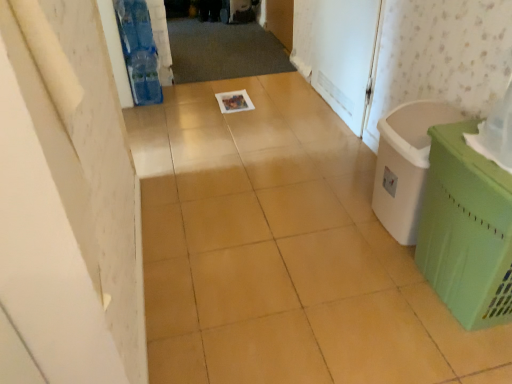
Question: From a real-world perspective, is green plastic laundry basket at right positioned over white matte screen door at upper right based on gravity?

Choices:
 (A) yes
 (B) no

Answer: (B)

Question: Does green plastic laundry basket at right have a larger size compared to white matte screen door at upper right?

Choices:
 (A) yes
 (B) no

Answer: (A)

Question: Is green plastic laundry basket at right wider than white matte screen door at upper right?

Choices:
 (A) no
 (B) yes

Answer: (B)

Question: Could white matte screen door at upper right be considered to be inside green plastic laundry basket at right?

Choices:
 (A) no
 (B) yes

Answer: (A)

Question: Considering the relative sizes of green plastic laundry basket at right and white matte screen door at upper right in the image provided, is green plastic laundry basket at right taller than white matte screen door at upper right?

Choices:
 (A) no
 (B) yes

Answer: (A)

Question: Is green plastic laundry basket at right not close to white matte screen door at upper right?

Choices:
 (A) no
 (B) yes

Answer: (A)

Question: Is white matte screen door at upper right located outside green plastic laundry basket at right?

Choices:
 (A) no
 (B) yes

Answer: (B)

Question: Is green plastic laundry basket at right surrounded by white matte screen door at upper right?

Choices:
 (A) no
 (B) yes

Answer: (A)

Question: Can you confirm if white matte screen door at upper right is shorter than green plastic laundry basket at right?

Choices:
 (A) yes
 (B) no

Answer: (B)

Question: From the image's perspective, does white matte screen door at upper right appear lower than green plastic laundry basket at right?

Choices:
 (A) no
 (B) yes

Answer: (A)

Question: From a real-world perspective, is white matte screen door at upper right under green plastic laundry basket at right?

Choices:
 (A) yes
 (B) no

Answer: (B)

Question: Considering the relative sizes of white matte screen door at upper right and green plastic laundry basket at right in the image provided, is white matte screen door at upper right bigger than green plastic laundry basket at right?

Choices:
 (A) no
 (B) yes

Answer: (A)

Question: Considering the relative positions of green plastic laundry basket at right and green plastic basket at right in the image provided, is green plastic laundry basket at right behind green plastic basket at right?

Choices:
 (A) no
 (B) yes

Answer: (B)